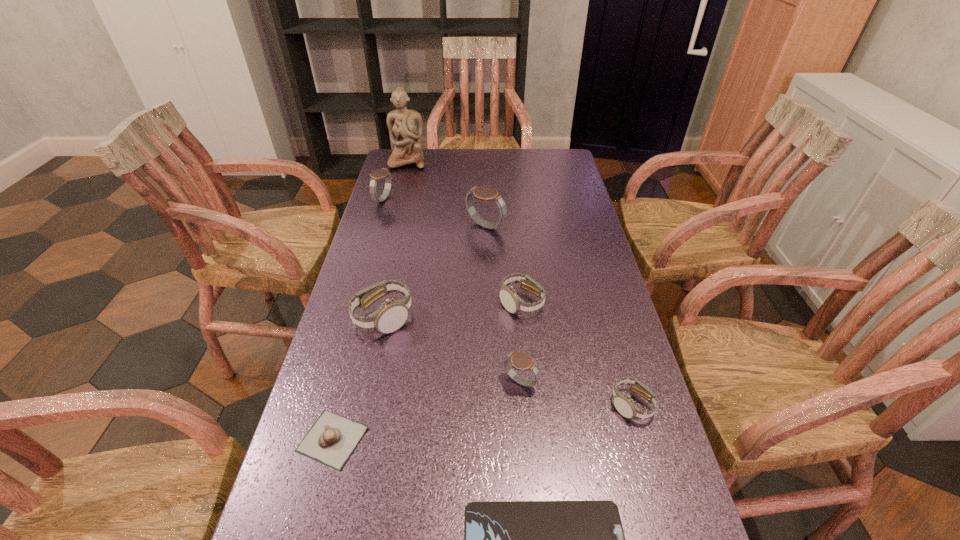
You are a GUI agent. You are given a task and a screenshot of the screen. Output one action in this format:
    pyautogui.click(x=<x>, y=<y>)
    Task: Click on the white figurine
    Image resolution: width=960 pixels, height=540 pixels.
    Given the screenshot: What is the action you would take?
    pyautogui.click(x=413, y=539)

At what (x,y) coordinates should I click in order to perform the action: click on the farthest object. Please return your answer as a coordinate pair (x, y). This screenshot has width=960, height=540. Looking at the image, I should click on (413, 539).

I want to click on the biggest gray watch, so click(413, 539).

Find the location of a particular element. This screenshot has height=540, width=960. the second tallest object is located at coordinates (413, 539).

Identify the location of the leftmost gray watch. This screenshot has width=960, height=540. (413, 539).

The image size is (960, 540). I want to click on the farthest watch, so click(413, 539).

At what (x,y) coordinates should I click in order to perform the action: click on the biggest white watch. Please return your answer as a coordinate pair (x, y). Looking at the image, I should click on click(413, 539).

Where is `the second white watch from right to left`? This screenshot has width=960, height=540. the second white watch from right to left is located at coordinates (413, 539).

The width and height of the screenshot is (960, 540). I want to click on the smallest gray watch, so click(x=479, y=539).

The image size is (960, 540). I want to click on the rightmost white watch, so click(x=413, y=539).